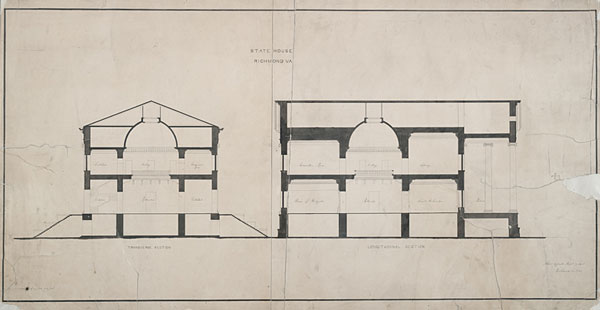
Locate an element on the screen. pillar is located at coordinates (514, 200).